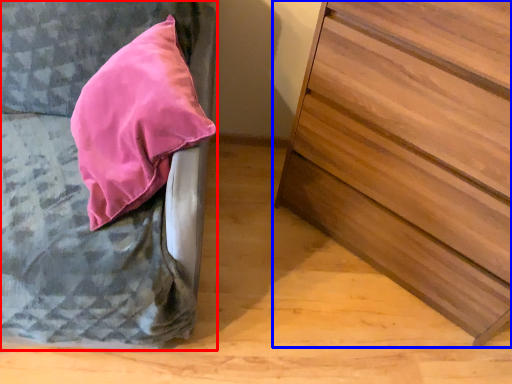
Question: Among these objects, which one is nearest to the camera, furniture (highlighted by a red box) or chest of drawers (highlighted by a blue box)?

Choices:
 (A) furniture
 (B) chest of drawers

Answer: (A)